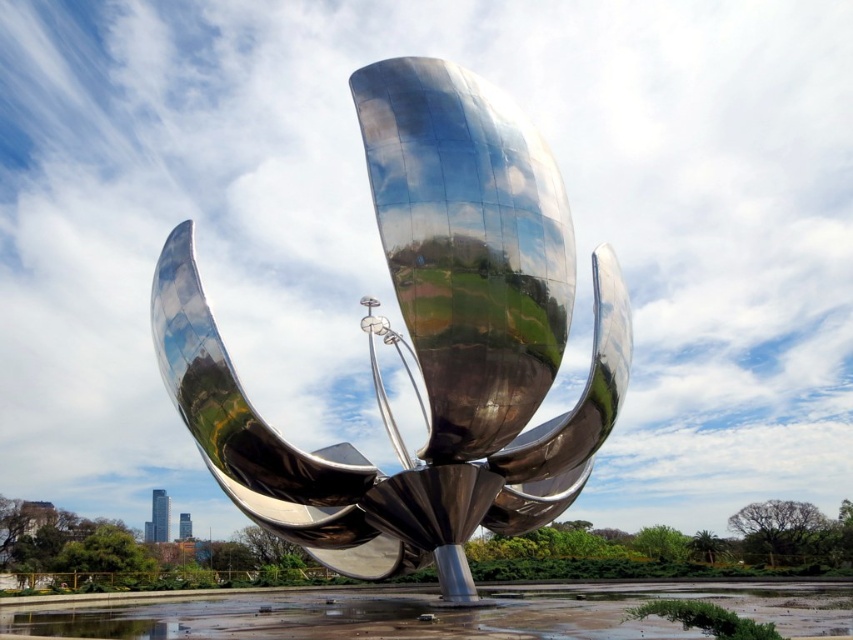
Consider the image. You are an artist planning to photograph the polished metallic flower at center and the shiny metallic sculpture at center. You need to know which one is narrower. Which object is narrower?

The polished metallic flower at center is narrower than the shiny metallic sculpture at center because its width is less than the sculpture.

You are an art student analyzing the sculpture. You notice two metallic parts in the sculpture labeled as the polished metallic flower at center and the shiny metallic sculpture at center. Which one is positioned higher up?

The polished metallic flower at center is positioned higher up than the shiny metallic sculpture at center.

You are standing at the origin point of a coordinate system where the sculpture is placed. The polished metallic flower at center is at coordinates 0.534, 0.501. If you want to walk directly towards the sculpture from your current position, which direction should you move in?

→ Since the polished metallic flower at center is located at coordinates (x=426, y=340), you should move northeast to reach it directly from the origin point.